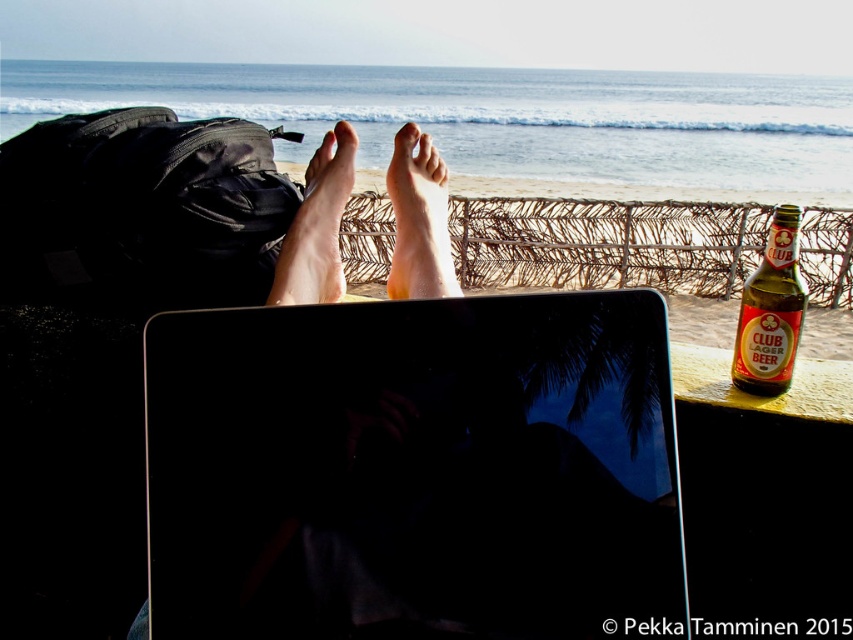
You are sitting on a beach with your feet on a woven mat. You have a green glass bottle at right and a pale skin foot at center. Which object is positioned lower in the image?

The green glass bottle at right is located below the pale skin foot at center, so it is positioned lower in the image.

You are a traveler who wants to place the green glass bottle at right next to your pale skin foot at center. Considering their sizes, will the bottle fit comfortably next to your foot without overlapping?

The green glass bottle at right has a lesser width compared to the pale skin foot at center, so it should fit comfortably next to the foot without overlapping.

You are standing on the beach and want to place your laptop so that it is directly in front of your feet. Given that your feet are at point [419,220], where should you position the laptop?

The dry skin foot at center is located at point [419,220], so you should position the laptop directly in front of this point to ensure it is aligned with your feet.